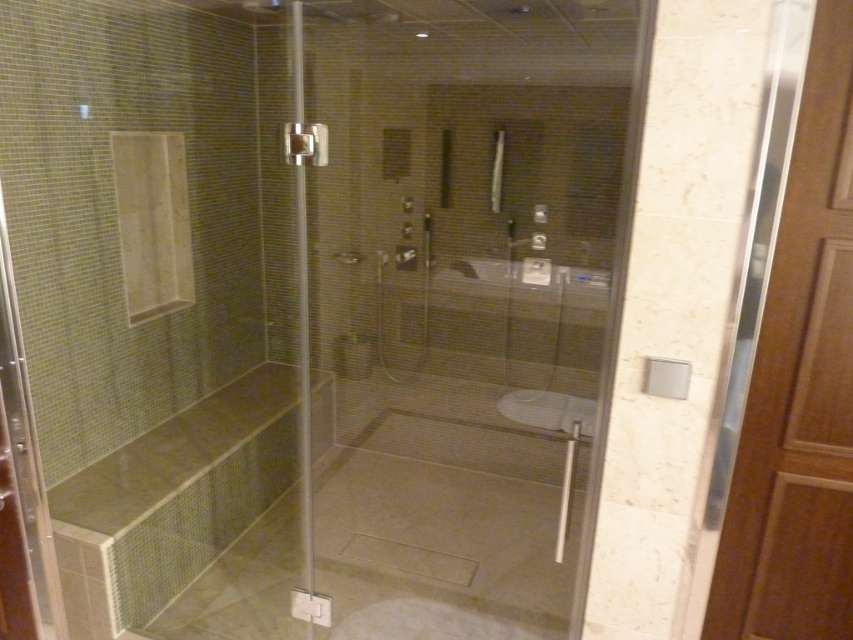
Is transparent glass door at center taller than satin nickel hinge at upper center?

Indeed, transparent glass door at center has a greater height compared to satin nickel hinge at upper center.

Can you confirm if transparent glass door at center is positioned to the right of satin nickel hinge at upper center?

Indeed, transparent glass door at center is positioned on the right side of satin nickel hinge at upper center.

The width and height of the screenshot is (853, 640). I want to click on transparent glass door at center, so click(459, 307).

I want to click on transparent glass door at center, so click(x=459, y=307).

Does point (821, 266) come in front of point (309, 138)?

Yes, it is in front of point (309, 138).

Can you confirm if clear glass screen door at right is positioned to the left of satin nickel hinge at upper center?

Incorrect, clear glass screen door at right is not on the left side of satin nickel hinge at upper center.

Does point (733, 547) come farther from viewer compared to point (311, 145)?

No, (733, 547) is in front of (311, 145).

Where is `clear glass screen door at right`? clear glass screen door at right is located at coordinates point(799,387).

Does transparent glass door at center have a lesser height compared to clear glass screen door at right?

In fact, transparent glass door at center may be taller than clear glass screen door at right.

Which is more to the left, transparent glass door at center or clear glass screen door at right?

From the viewer's perspective, transparent glass door at center appears more on the left side.

Is point (581, 561) in front of point (844, 305)?

No.

Where is `transparent glass door at center`? This screenshot has width=853, height=640. transparent glass door at center is located at coordinates (459, 307).